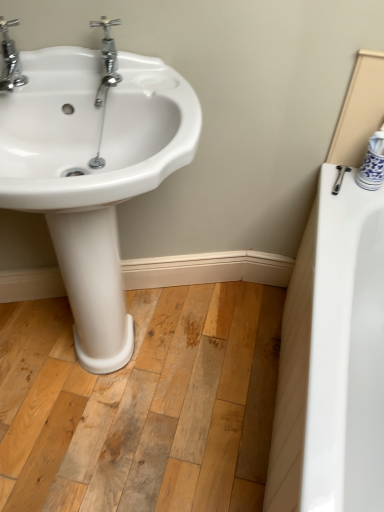
The width and height of the screenshot is (384, 512). In order to click on free space in front of white glossy sink at left in this screenshot , I will do `click(110, 457)`.